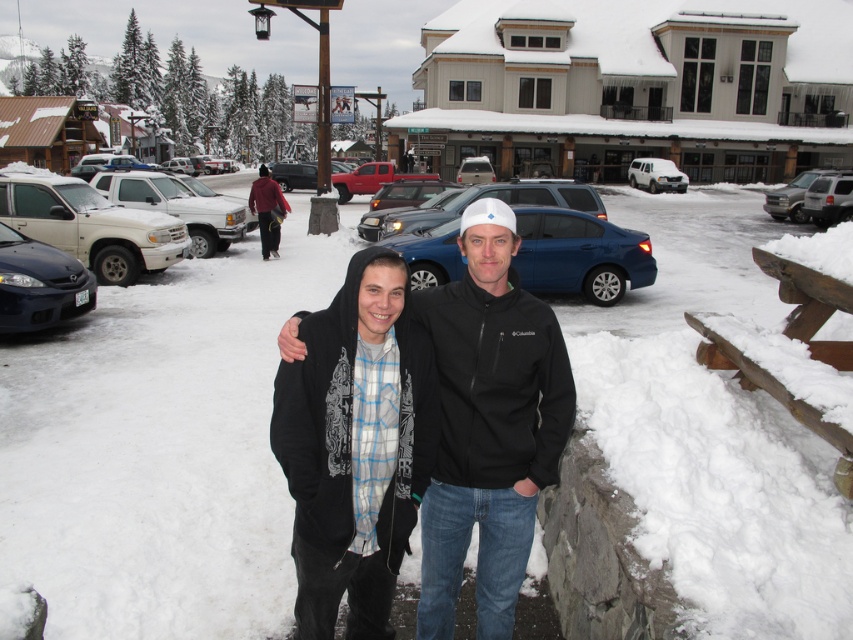
You are a delivery driver who needs to park your truck between the satin blue suv at center and the satin silver sedan at center. Your truck is 5 meters long. Is there enough space between them to park your truck?

The satin blue suv at center and satin silver sedan at center are 18.32 meters apart. Since your truck is only 5 meters long, there is more than enough space between them to park your truck.

You are a photographer planning to capture a wide shot of the snowy scene. The blue metallic sedan at center and the matte white truck at left are both in your frame. Since you want to emphasize the height difference between them, which vehicle should you position closer to the camera to make the smaller one appear larger?

The blue metallic sedan at center is not as tall as the matte white truck at left. To make the smaller blue metallic sedan at center appear larger, position it closer to the camera while keeping the taller matte white truck at left further back. This creates a visual contrast in their perceived sizes due to proximity.